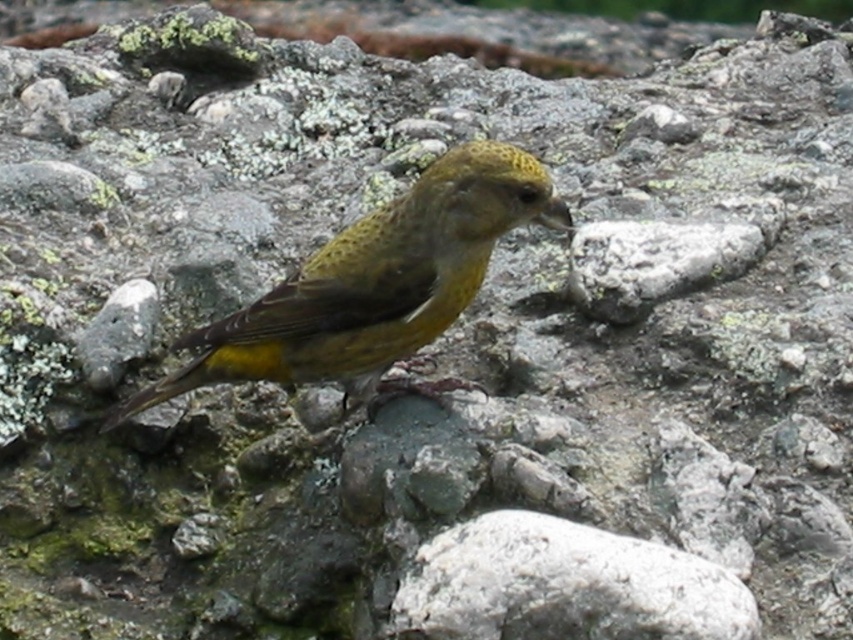
Between greenish-yellow feathers at center and white rough rock at center, which one appears on the left side from the viewer's perspective?

Positioned to the left is greenish-yellow feathers at center.

Who is shorter, greenish-yellow feathers at center or white rough rock at center?

white rough rock at center is shorter.

Image resolution: width=853 pixels, height=640 pixels. Find the location of `greenish-yellow feathers at center`. greenish-yellow feathers at center is located at coordinates (374, 285).

Identify the location of greenish-yellow feathers at center. (374, 285).